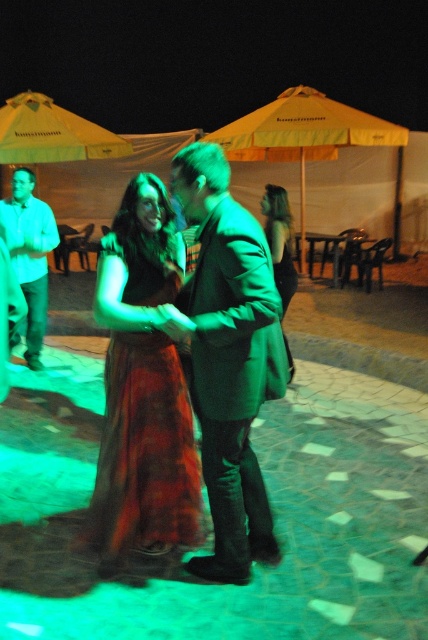
Who is shorter, velvet rust dress at center or matte white shirt at left?

With less height is velvet rust dress at center.

Where is `velvet rust dress at center`? The width and height of the screenshot is (428, 640). velvet rust dress at center is located at coordinates (145, 451).

Who is more forward, (x=109, y=352) or (x=287, y=208)?

Point (x=109, y=352) is in front.

Between velvet rust dress at center and green matte dress at center, which one is positioned lower?

velvet rust dress at center is lower down.

At what (x,y) coordinates should I click in order to perform the action: click on velvet rust dress at center. Please return your answer as a coordinate pair (x, y). The image size is (428, 640). Looking at the image, I should click on (145, 451).

You are a GUI agent. You are given a task and a screenshot of the screen. Output one action in this format:
    pyautogui.click(x=<x>, y=<y>)
    Task: Click on the velvet rust dress at center
    The height and width of the screenshot is (640, 428).
    Given the screenshot: What is the action you would take?
    pyautogui.click(x=145, y=451)

At what (x,y) coordinates should I click in order to perform the action: click on matte green dress at center. Please return your answer as a coordinate pair (x, y). The image size is (428, 640). Looking at the image, I should click on (187, 365).

Describe the element at coordinates (187, 365) in the screenshot. The image size is (428, 640). I see `matte green dress at center` at that location.

Does point (186, 321) come behind point (287, 220)?

No, (186, 321) is closer to viewer.

The width and height of the screenshot is (428, 640). Identify the location of matte green dress at center. (187, 365).